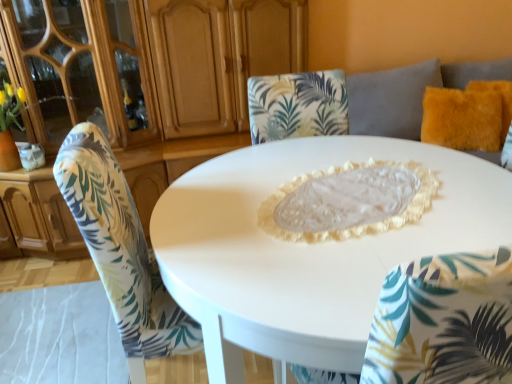
Question: Should I look upward or downward to see printed fabric chair at center?

Choices:
 (A) down
 (B) up

Answer: (A)

Question: Can you confirm if fuzzy orange pillow at upper right is positioned to the left of printed fabric chair at center?

Choices:
 (A) yes
 (B) no

Answer: (B)

Question: Is there a large distance between fuzzy orange pillow at upper right and printed fabric chair at center?

Choices:
 (A) no
 (B) yes

Answer: (B)

Question: Does fuzzy orange pillow at upper right lie in front of printed fabric chair at center?

Choices:
 (A) yes
 (B) no

Answer: (B)

Question: Is fuzzy orange pillow at upper right oriented towards printed fabric chair at center?

Choices:
 (A) no
 (B) yes

Answer: (A)

Question: From a real-world perspective, is fuzzy orange pillow at upper right beneath printed fabric chair at center?

Choices:
 (A) yes
 (B) no

Answer: (B)

Question: Is fuzzy orange pillow at upper right taller than printed fabric chair at center?

Choices:
 (A) yes
 (B) no

Answer: (B)

Question: From the image's perspective, is matte wood dresser at upper left above fuzzy orange pillow at upper right?

Choices:
 (A) no
 (B) yes

Answer: (A)

Question: From a real-world perspective, is matte wood dresser at upper left beneath fuzzy orange pillow at upper right?

Choices:
 (A) yes
 (B) no

Answer: (B)

Question: Can we say matte wood dresser at upper left lies outside fuzzy orange pillow at upper right?

Choices:
 (A) yes
 (B) no

Answer: (A)

Question: From a real-world perspective, is matte wood dresser at upper left on fuzzy orange pillow at upper right?

Choices:
 (A) no
 (B) yes

Answer: (B)

Question: Is matte wood dresser at upper left facing towards fuzzy orange pillow at upper right?

Choices:
 (A) yes
 (B) no

Answer: (B)

Question: Are matte wood dresser at upper left and fuzzy orange pillow at upper right far apart?

Choices:
 (A) yes
 (B) no

Answer: (A)

Question: Is printed fabric chair at center shorter than matte wood dresser at upper left?

Choices:
 (A) yes
 (B) no

Answer: (A)